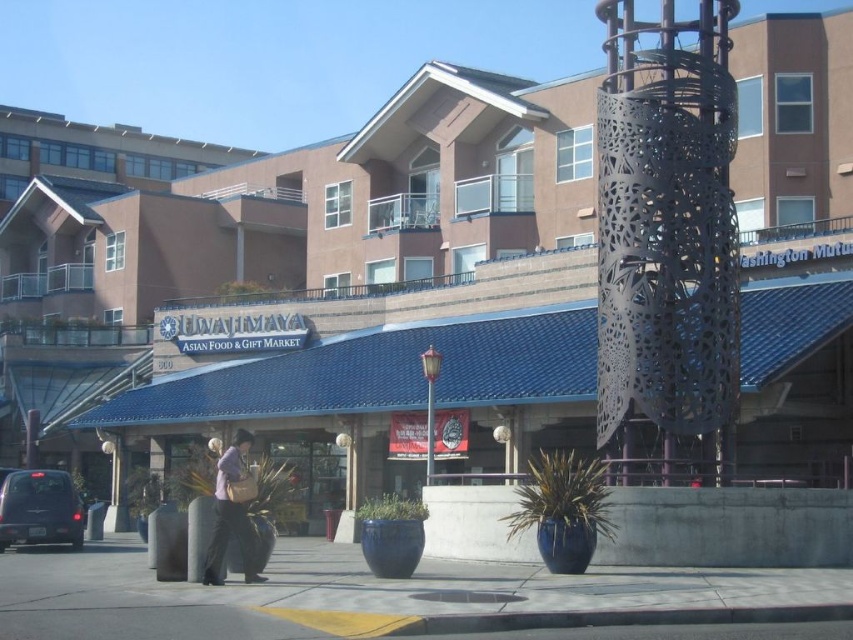
Between black perforated metal tower at center and light purple fabric bag at lower center, which one has more height?

black perforated metal tower at center is taller.

Who is higher up, black perforated metal tower at center or light purple fabric bag at lower center?

Positioned higher is black perforated metal tower at center.

Between point (706, 340) and point (229, 458), which one is positioned behind?

The point (706, 340) is behind.

Locate an element on the screen. Image resolution: width=853 pixels, height=640 pixels. black perforated metal tower at center is located at coordinates (666, 236).

Looking at this image, is matte black van at lower left positioned at the back of light purple fabric bag at lower center?

That is True.

Is matte black van at lower left bigger than light purple fabric bag at lower center?

No.

Is point (33, 525) positioned before point (219, 577)?

No, (33, 525) is behind (219, 577).

Find the location of a particular element. The image size is (853, 640). matte black van at lower left is located at coordinates (39, 509).

In the scene shown: Between black perforated metal tower at center and gray concrete pavement at lower center, which one appears on the right side from the viewer's perspective?

black perforated metal tower at center is more to the right.

Does point (608, 248) lie in front of point (169, 595)?

No.

Is point (670, 342) positioned behind point (306, 577)?

Yes, point (670, 342) is behind point (306, 577).

In order to click on black perforated metal tower at center in this screenshot , I will do `click(666, 236)`.